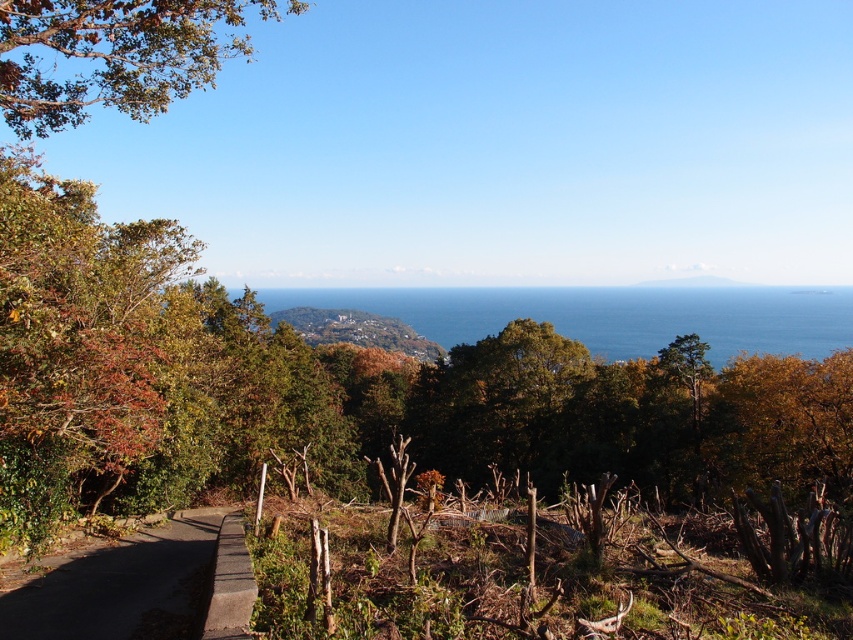
Question: Is blue water at center closer to the viewer compared to gray concrete path at lower left?

Choices:
 (A) yes
 (B) no

Answer: (B)

Question: Is the position of green leafy tree at upper left less distant than that of gray concrete path at lower left?

Choices:
 (A) no
 (B) yes

Answer: (A)

Question: Estimate the real-world distances between objects in this image. Which object is closer to the gray concrete path at lower left?

Choices:
 (A) green grassy hillside at center
 (B) concrete path at lower left
 (C) blue water at center

Answer: (B)

Question: Can you confirm if gray concrete path at lower left is positioned to the right of concrete path at lower left?

Choices:
 (A) yes
 (B) no

Answer: (B)

Question: Estimate the real-world distances between objects in this image. Which object is farther from the green grassy hillside at center?

Choices:
 (A) blue water at center
 (B) concrete path at lower left
 (C) green leafy tree at upper left
 (D) gray concrete path at lower left

Answer: (B)

Question: Estimate the real-world distances between objects in this image. Which object is closer to the concrete path at lower left?

Choices:
 (A) green grassy hillside at center
 (B) blue water at center

Answer: (A)